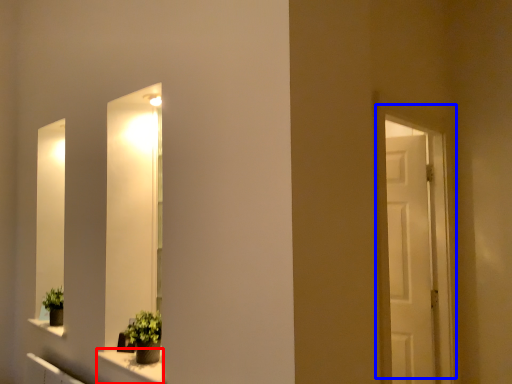
Question: Which object appears closest to the camera in this image, window sill (highlighted by a red box) or door (highlighted by a blue box)?

Choices:
 (A) window sill
 (B) door

Answer: (A)